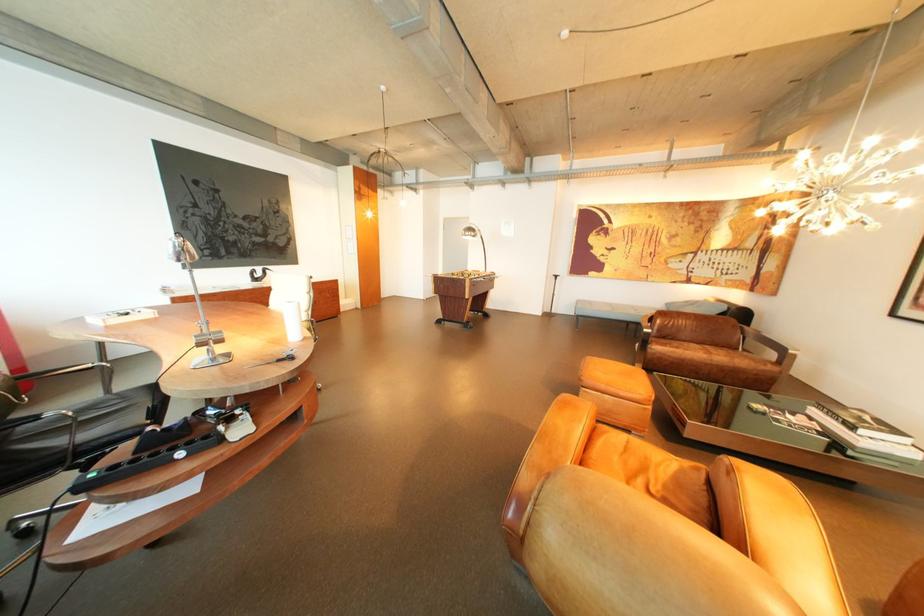
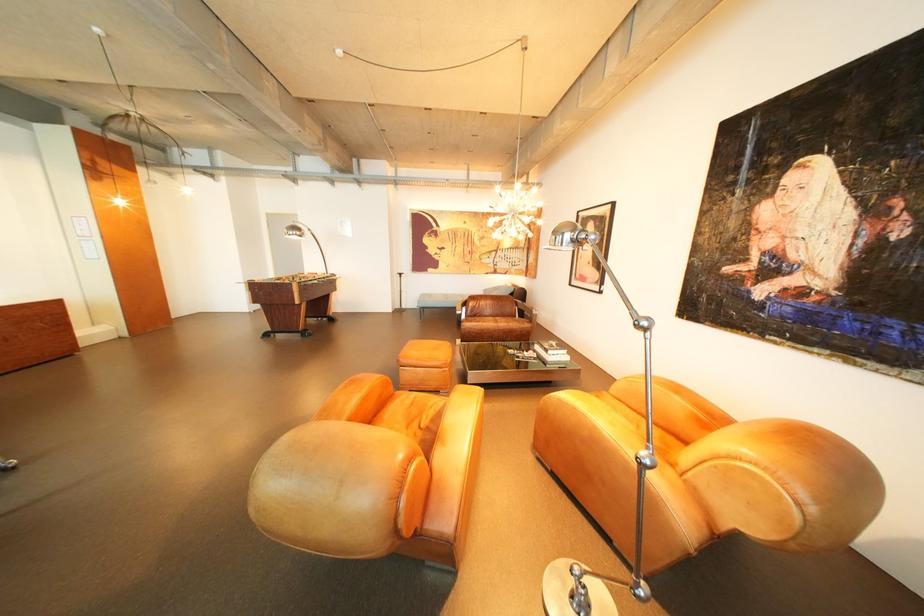
Question: The camera is either moving clockwise (left) or counter-clockwise (right) around the object. The first image is from the beginning of the video and the second image is from the end. Is the camera moving left or right when shooting the video?

Choices:
 (A) Left
 (B) Right

Answer: (A)